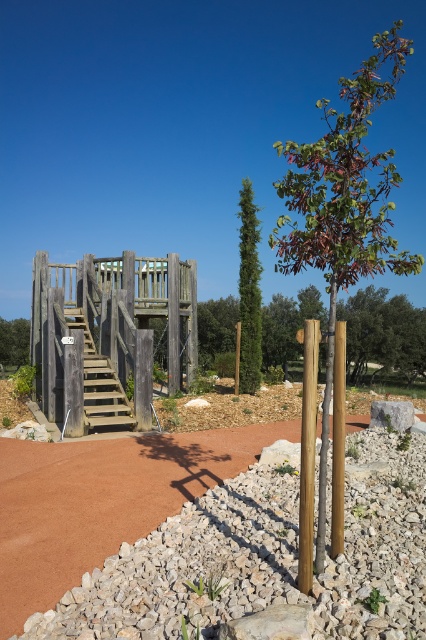
Question: Which of the following is the closest to the observer?

Choices:
 (A) (22, 342)
 (B) (391, 237)

Answer: (B)

Question: Is brown gravel at lower left thinner than green textured tree at center?

Choices:
 (A) no
 (B) yes

Answer: (A)

Question: Which object is farther from the camera taking this photo?

Choices:
 (A) brown gravel at lower left
 (B) wooden stairs at center

Answer: (B)

Question: Is brown gravel at lower left above smooth brown pole at right?

Choices:
 (A) yes
 (B) no

Answer: (B)

Question: Which point is closer to the camera taking this photo?

Choices:
 (A) (23, 358)
 (B) (319, 140)
 (C) (307, 508)
 (D) (235, 467)

Answer: (C)

Question: Is green textured tree at center positioned at the back of brown wooden tree at left?

Choices:
 (A) yes
 (B) no

Answer: (B)